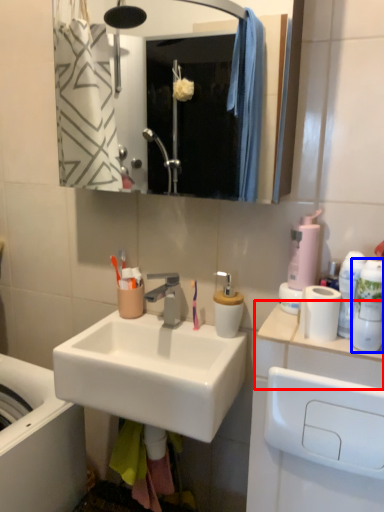
Question: Which object appears farthest to the camera in this image, counter top (highlighted by a red box) or mouthwash (highlighted by a blue box)?

Choices:
 (A) counter top
 (B) mouthwash

Answer: (B)